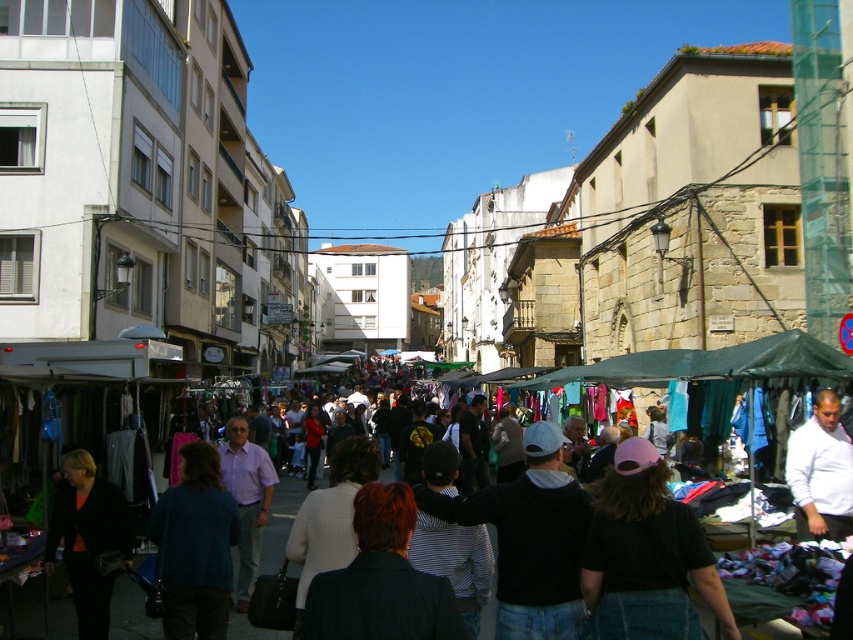
Question: Where is white matte shirt at center-right located in relation to green fabric tent at center in the image?

Choices:
 (A) right
 (B) left

Answer: (A)

Question: Does black leather jacket at lower left have a lesser width compared to white matte shirt at center-right?

Choices:
 (A) no
 (B) yes

Answer: (B)

Question: Does black leather jacket at lower left have a larger size compared to white matte shirt at center-right?

Choices:
 (A) yes
 (B) no

Answer: (B)

Question: Which point is farther to the camera?

Choices:
 (A) (631, 534)
 (B) (91, 388)
 (C) (93, 628)

Answer: (B)

Question: Which object appears closest to the camera in this image?

Choices:
 (A) green fabric tent at center
 (B) black leather jacket at lower left

Answer: (A)

Question: Which object is positioned closest to the black leather jacket at lower left?

Choices:
 (A) white matte shirt at center-right
 (B) green fabric tent at center
 (C) black matte cap at center

Answer: (B)